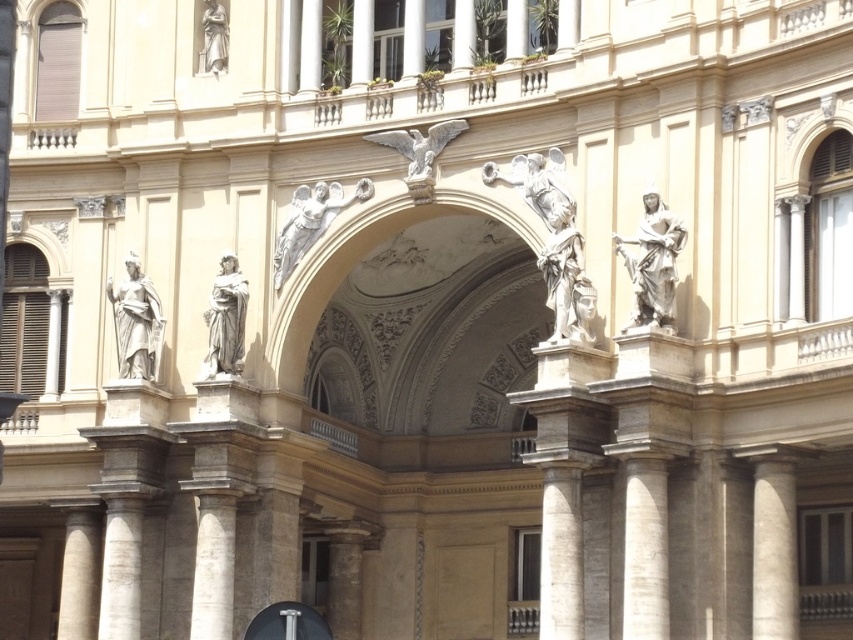
Question: Estimate the real-world distances between objects in this image. Which object is farther from the white marble statue at upper center?

Choices:
 (A) white marble statue at center
 (B) matte stone statue at left
 (C) white marble angel at center

Answer: (A)

Question: Can you confirm if white marble statue at center is positioned above metallic silver signpost at center?

Choices:
 (A) no
 (B) yes

Answer: (B)

Question: Which of the following is the farthest from the observer?

Choices:
 (A) (136, 294)
 (B) (643, 227)

Answer: (A)

Question: Is matte stone statue at left thinner than white marble statue at upper center?

Choices:
 (A) no
 (B) yes

Answer: (A)

Question: Which object is farther from the camera taking this photo?

Choices:
 (A) white marble statue at upper center
 (B) matte stone statue at left
 (C) white marble statue at center

Answer: (A)

Question: Can you confirm if white marble statue at center is bigger than metallic silver signpost at center?

Choices:
 (A) yes
 (B) no

Answer: (B)